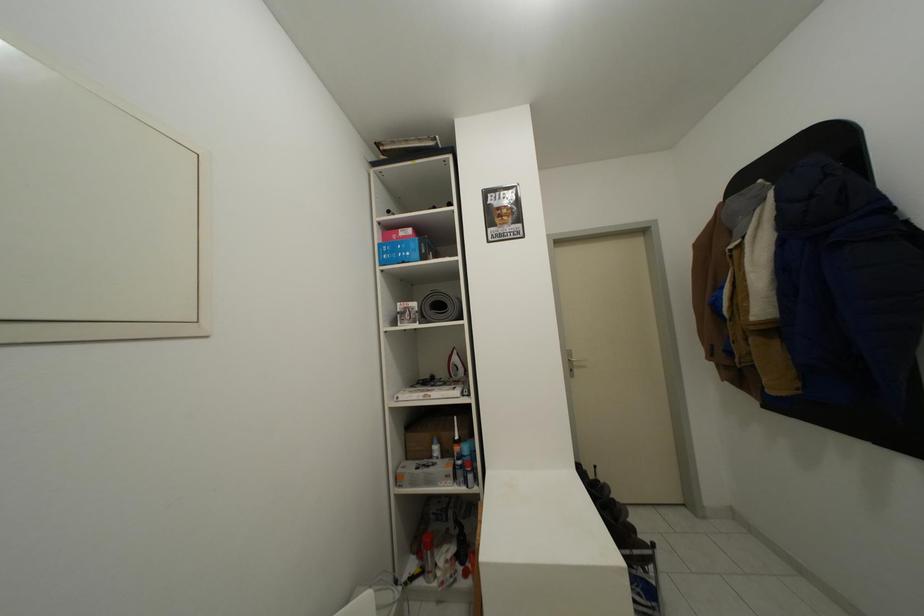
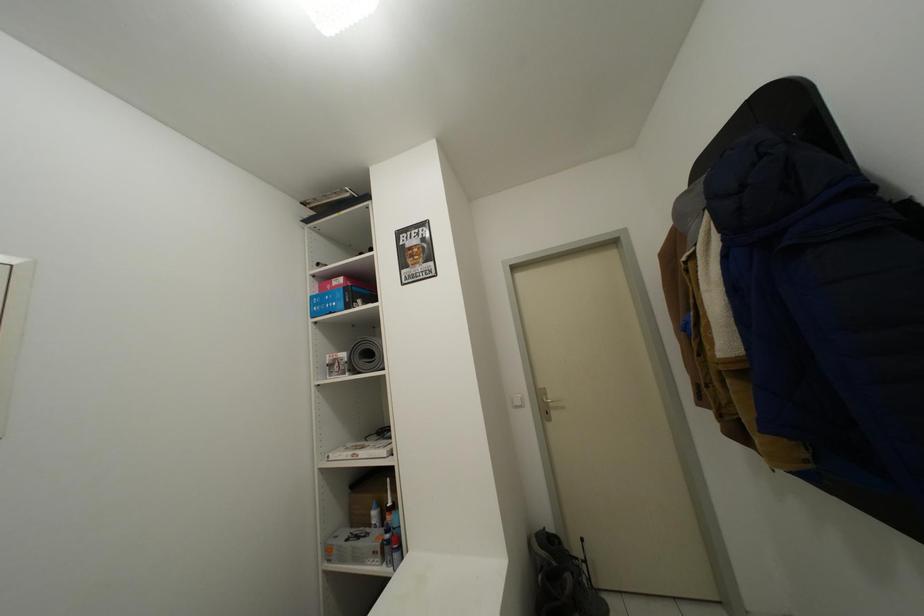
Question: How did the camera likely rotate?

Choices:
 (A) Left
 (B) Right
 (C) Up
 (D) Down

Answer: (A)